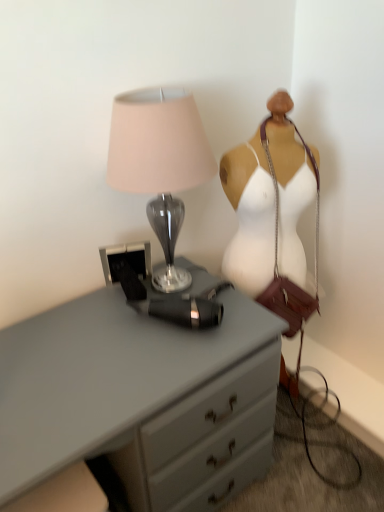
I want to click on vacant region in front of satin gray lamp at upper left, so click(x=147, y=355).